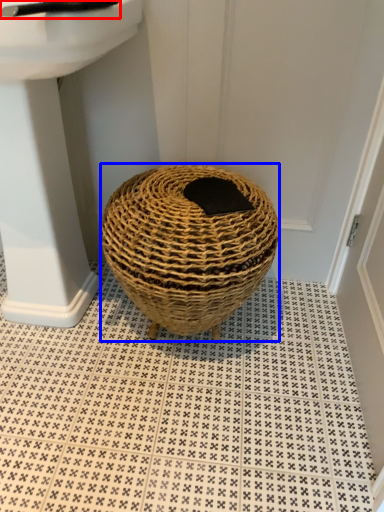
Question: Which point is further to the camera, faucet (highlighted by a red box) or basket (highlighted by a blue box)?

Choices:
 (A) faucet
 (B) basket

Answer: (B)